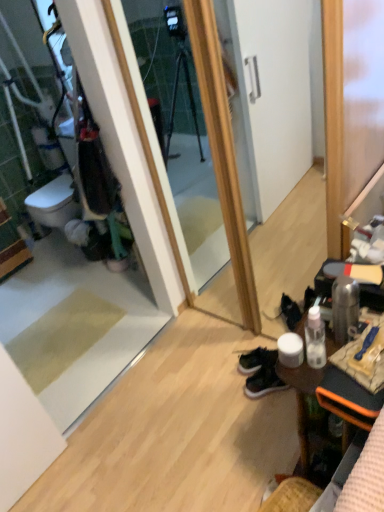
Question: Considering the relative sizes of wooden desk at lower right and dark green suede sneakers at lower right, the 2th footwear viewed from the front, in the image provided, is wooden desk at lower right bigger than dark green suede sneakers at lower right, the 2th footwear viewed from the front,?

Choices:
 (A) no
 (B) yes

Answer: (B)

Question: Is wooden desk at lower right surrounding dark green suede sneakers at lower right, arranged as the first footwear when viewed from the back?

Choices:
 (A) yes
 (B) no

Answer: (B)

Question: From a real-world perspective, is wooden desk at lower right on dark green suede sneakers at lower right, the 2th footwear viewed from the front?

Choices:
 (A) yes
 (B) no

Answer: (A)

Question: From the image's perspective, does wooden desk at lower right appear lower than dark green suede sneakers at lower right, the 2th footwear viewed from the front?

Choices:
 (A) no
 (B) yes

Answer: (A)

Question: Considering the relative sizes of wooden desk at lower right and dark green suede sneakers at lower right, the 2th footwear viewed from the front, in the image provided, is wooden desk at lower right thinner than dark green suede sneakers at lower right, the 2th footwear viewed from the front,?

Choices:
 (A) no
 (B) yes

Answer: (A)

Question: Relative to dark green suede sneakers at lower right, the 2th footwear viewed from the front, is green suede sneakers at lower center, which appears as the first footwear when viewed from the front, in front or behind?

Choices:
 (A) front
 (B) behind

Answer: (A)

Question: Is green suede sneakers at lower center, which appears as the first footwear when viewed from the front, wider or thinner than dark green suede sneakers at lower right, arranged as the first footwear when viewed from the back?

Choices:
 (A) thin
 (B) wide

Answer: (A)

Question: From the image's perspective, is green suede sneakers at lower center, which appears as the first footwear when viewed from the front, positioned above or below dark green suede sneakers at lower right, arranged as the first footwear when viewed from the back?

Choices:
 (A) above
 (B) below

Answer: (B)

Question: In terms of size, does green suede sneakers at lower center, marked as the second footwear in a back-to-front arrangement, appear bigger or smaller than dark green suede sneakers at lower right, the 2th footwear viewed from the front?

Choices:
 (A) big
 (B) small

Answer: (B)

Question: From the image's perspective, is dark green suede sneakers at lower right, the 2th footwear viewed from the front, positioned above or below wooden desk at lower right?

Choices:
 (A) above
 (B) below

Answer: (B)

Question: From a real-world perspective, relative to wooden desk at lower right, is dark green suede sneakers at lower right, the 2th footwear viewed from the front, vertically above or below?

Choices:
 (A) above
 (B) below

Answer: (B)

Question: In terms of width, does dark green suede sneakers at lower right, the 2th footwear viewed from the front, look wider or thinner when compared to wooden desk at lower right?

Choices:
 (A) thin
 (B) wide

Answer: (A)

Question: Would you say dark green suede sneakers at lower right, the 2th footwear viewed from the front, is to the left or to the right of wooden desk at lower right in the picture?

Choices:
 (A) right
 (B) left

Answer: (B)

Question: From a real-world perspective, is green suede sneakers at lower center, marked as the second footwear in a back-to-front arrangement, physically located above or below wooden desk at lower right?

Choices:
 (A) above
 (B) below

Answer: (B)

Question: Is green suede sneakers at lower center, marked as the second footwear in a back-to-front arrangement, in front of or behind wooden desk at lower right in the image?

Choices:
 (A) front
 (B) behind

Answer: (B)